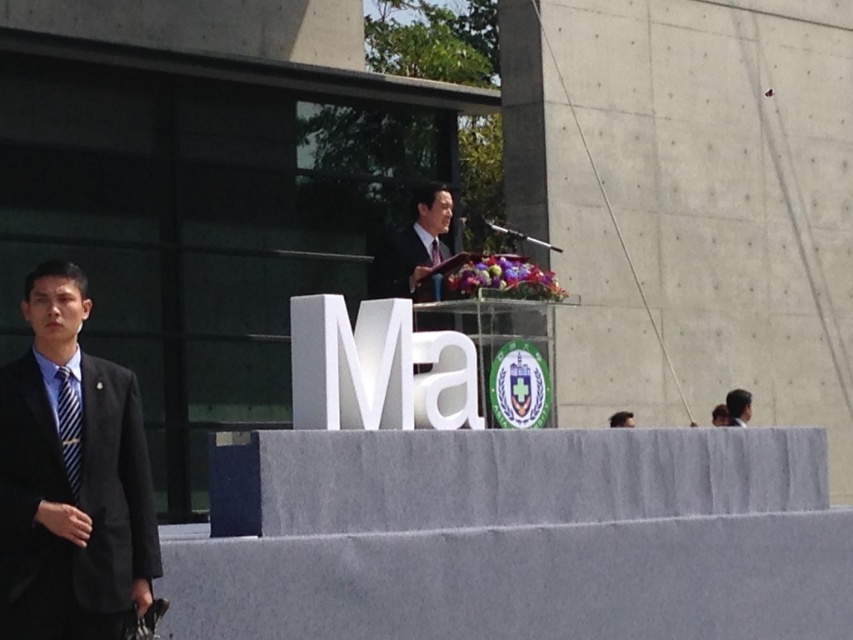
Looking at this image, you are a photographer at this event. You need to capture a photo where both the black suit at left and the dark brown hair at upper right are clearly visible. Based on their sizes in the image, which one should you focus on first to ensure clarity?

The black suit at left is larger in size than the dark brown hair at upper right, so you should focus on the black suit at left first to ensure clarity since larger objects typically require more precise focusing to maintain sharpness.

You are an event planner trying to arrange seating for the attendees. You notice the matte black suit at center and the dark brown hair at upper right in the image. Which of these two elements is wider in the scene?

The matte black suit at center is wider than the dark brown hair at upper right according to the description.